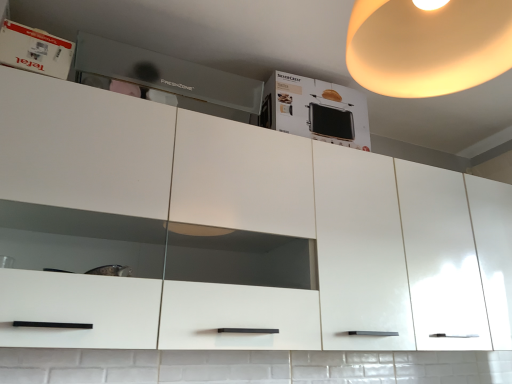
Question: Can you confirm if warm matte lampshade at upper right is wider than matte gray drawer at upper center?

Choices:
 (A) no
 (B) yes

Answer: (B)

Question: Is warm matte lampshade at upper right in front of matte gray drawer at upper center?

Choices:
 (A) no
 (B) yes

Answer: (B)

Question: Would you say warm matte lampshade at upper right is outside matte gray drawer at upper center?

Choices:
 (A) yes
 (B) no

Answer: (A)

Question: Is warm matte lampshade at upper right shorter than matte gray drawer at upper center?

Choices:
 (A) no
 (B) yes

Answer: (A)

Question: Is warm matte lampshade at upper right taller than matte gray drawer at upper center?

Choices:
 (A) no
 (B) yes

Answer: (B)

Question: Considering the relative sizes of warm matte lampshade at upper right and matte gray drawer at upper center in the image provided, is warm matte lampshade at upper right smaller than matte gray drawer at upper center?

Choices:
 (A) yes
 (B) no

Answer: (B)

Question: Could you tell me if matte gray drawer at upper center is turned towards white glossy box at upper left?

Choices:
 (A) yes
 (B) no

Answer: (B)

Question: Is matte gray drawer at upper center not close to white glossy box at upper left?

Choices:
 (A) yes
 (B) no

Answer: (B)

Question: Is matte gray drawer at upper center next to white glossy box at upper left and touching it?

Choices:
 (A) no
 (B) yes

Answer: (A)

Question: Is matte gray drawer at upper center further to camera compared to white glossy box at upper left?

Choices:
 (A) yes
 (B) no

Answer: (A)

Question: Can we say matte gray drawer at upper center lies outside white glossy box at upper left?

Choices:
 (A) yes
 (B) no

Answer: (A)

Question: Does matte gray drawer at upper center have a lesser width compared to white glossy box at upper left?

Choices:
 (A) yes
 (B) no

Answer: (B)

Question: Considering the relative sizes of warm matte lampshade at upper right and white cardboard box at upper center in the image provided, is warm matte lampshade at upper right shorter than white cardboard box at upper center?

Choices:
 (A) yes
 (B) no

Answer: (B)